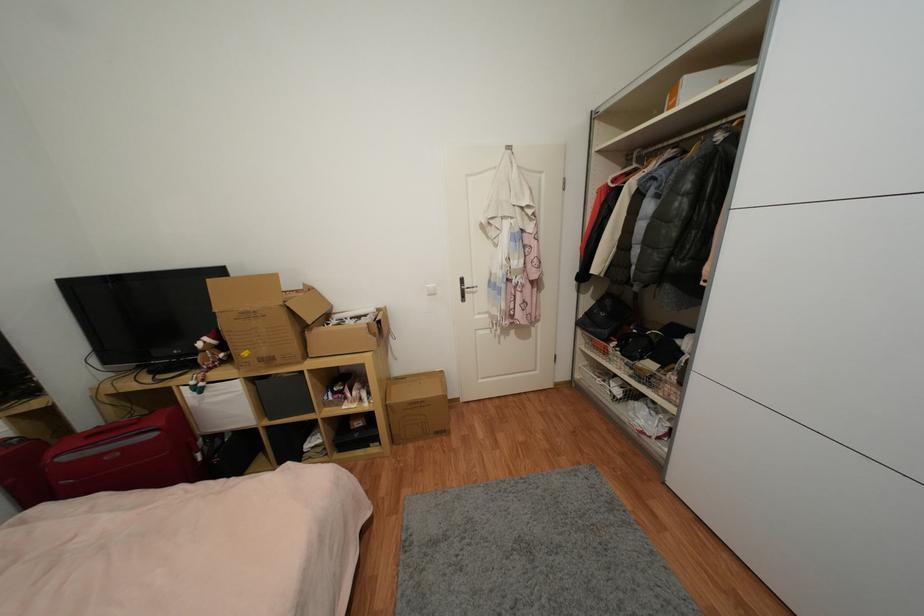
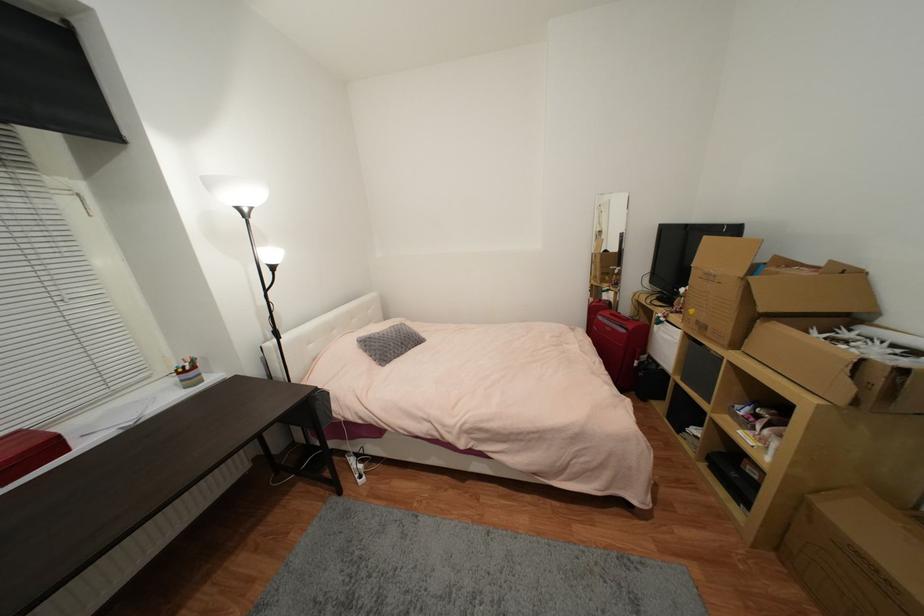
Find the pixel in the second image that matches point (274, 361) in the first image.

(708, 329)